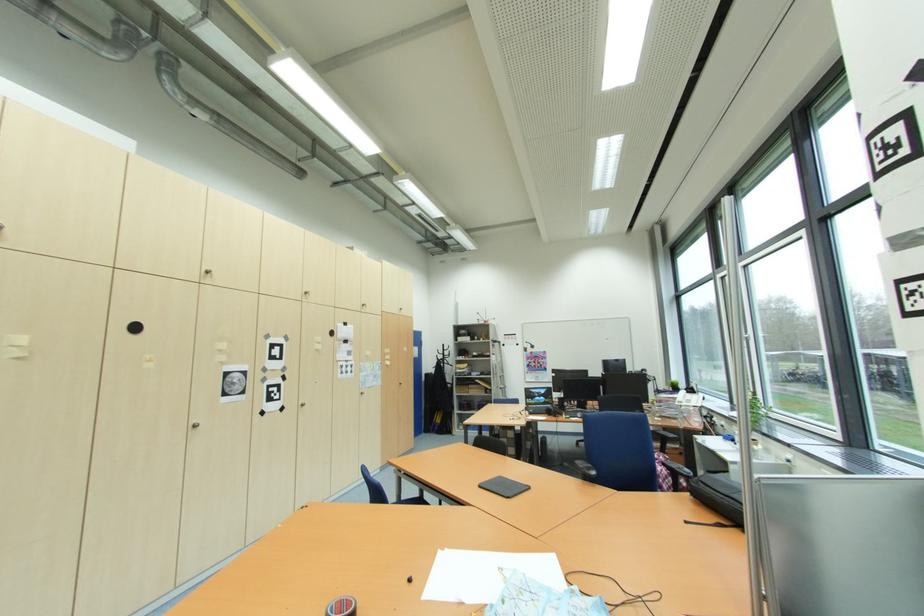
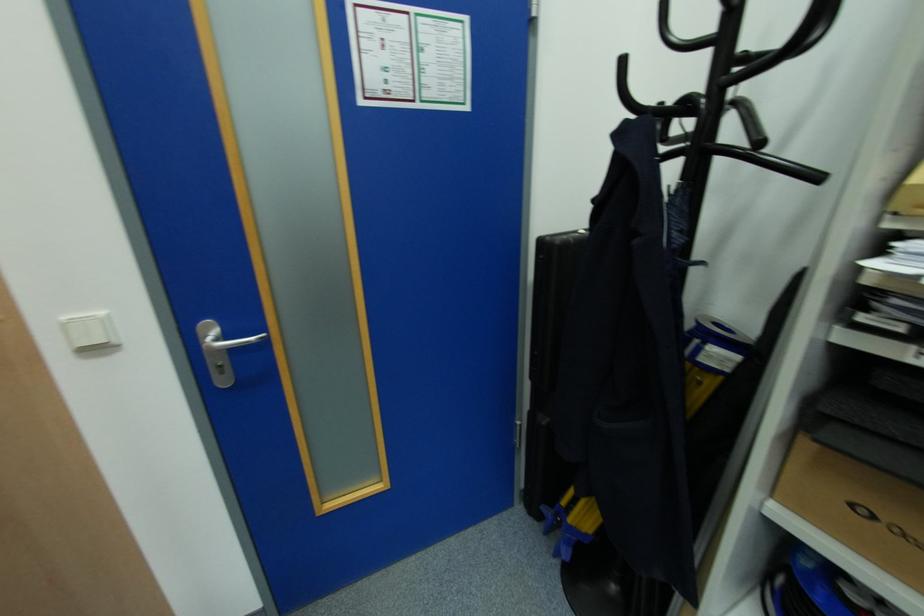
Where in the second image is the point corresponding to (x=432, y=407) from the first image?

(548, 421)